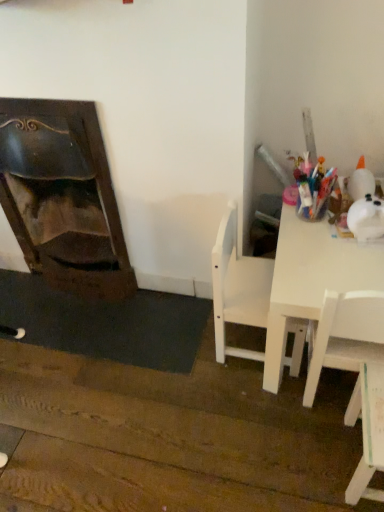
Question: From the image's perspective, is white matte chair at lower right, marked as the first chair in a right-to-left arrangement, beneath white matte chair at center, placed as the first chair when sorted from left to right?

Choices:
 (A) no
 (B) yes

Answer: (B)

Question: Does white matte chair at lower right, positioned as the 2th chair in left-to-right order, appear on the right side of white matte chair at center, marked as the 2th chair in a right-to-left arrangement?

Choices:
 (A) yes
 (B) no

Answer: (A)

Question: Is white matte chair at lower right, marked as the first chair in a right-to-left arrangement, looking in the opposite direction of white matte chair at center, placed as the first chair when sorted from left to right?

Choices:
 (A) no
 (B) yes

Answer: (A)

Question: From a real-world perspective, is white matte chair at lower right, marked as the first chair in a right-to-left arrangement, positioned under white matte chair at center, marked as the 2th chair in a right-to-left arrangement, based on gravity?

Choices:
 (A) no
 (B) yes

Answer: (B)

Question: Is white matte chair at lower right, positioned as the 2th chair in left-to-right order, shorter than white matte chair at center, marked as the 2th chair in a right-to-left arrangement?

Choices:
 (A) no
 (B) yes

Answer: (B)

Question: Is white matte chair at lower right, positioned as the 2th chair in left-to-right order, to the left of white matte chair at center, marked as the 2th chair in a right-to-left arrangement, from the viewer's perspective?

Choices:
 (A) yes
 (B) no

Answer: (B)

Question: Are white glossy table at right and dark wood fireplace at left beside each other?

Choices:
 (A) no
 (B) yes

Answer: (A)

Question: Considering the relative sizes of white glossy table at right and dark wood fireplace at left in the image provided, is white glossy table at right taller than dark wood fireplace at left?

Choices:
 (A) no
 (B) yes

Answer: (A)

Question: Considering the relative sizes of white glossy table at right and dark wood fireplace at left in the image provided, is white glossy table at right smaller than dark wood fireplace at left?

Choices:
 (A) yes
 (B) no

Answer: (B)

Question: Does white glossy table at right appear on the right side of dark wood fireplace at left?

Choices:
 (A) no
 (B) yes

Answer: (B)

Question: From a real-world perspective, is white glossy table at right under dark wood fireplace at left?

Choices:
 (A) yes
 (B) no

Answer: (A)

Question: Could you tell me if white glossy table at right is turned towards dark wood fireplace at left?

Choices:
 (A) no
 (B) yes

Answer: (B)

Question: From the image's perspective, is white glossy table at right above white matte chair at center, marked as the 2th chair in a right-to-left arrangement?

Choices:
 (A) yes
 (B) no

Answer: (A)